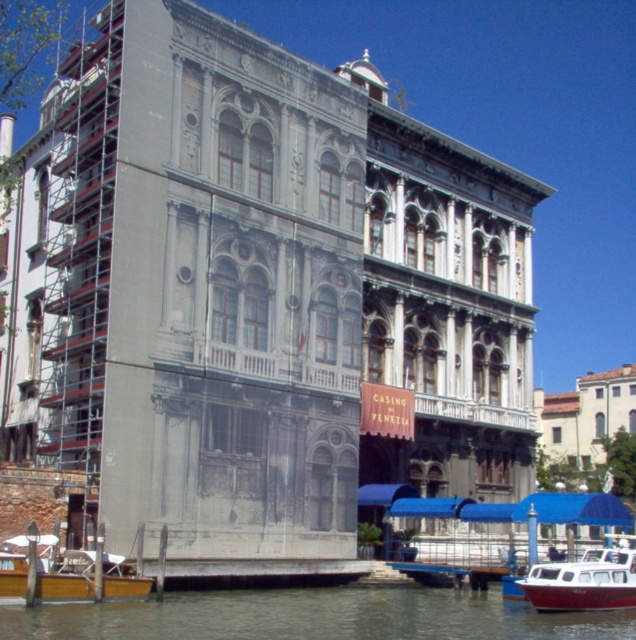
You are a tour guide leading a group of visitors along the canal. You want to inform them about the distance between the greenish water at lower center and the white plastic boat at lower right. What would you tell them?

The distance between the greenish water at lower center and the white plastic boat at lower right is 19.12 feet.